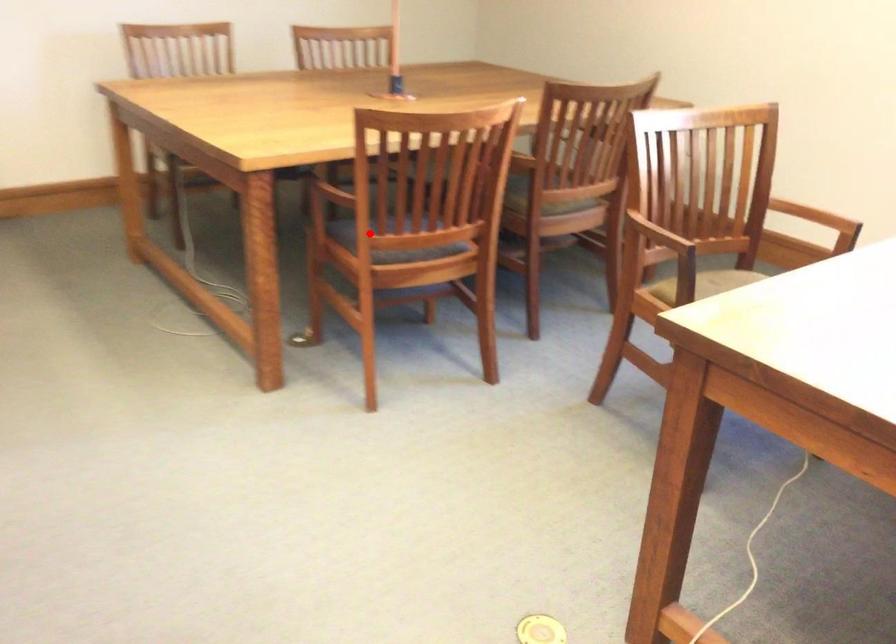
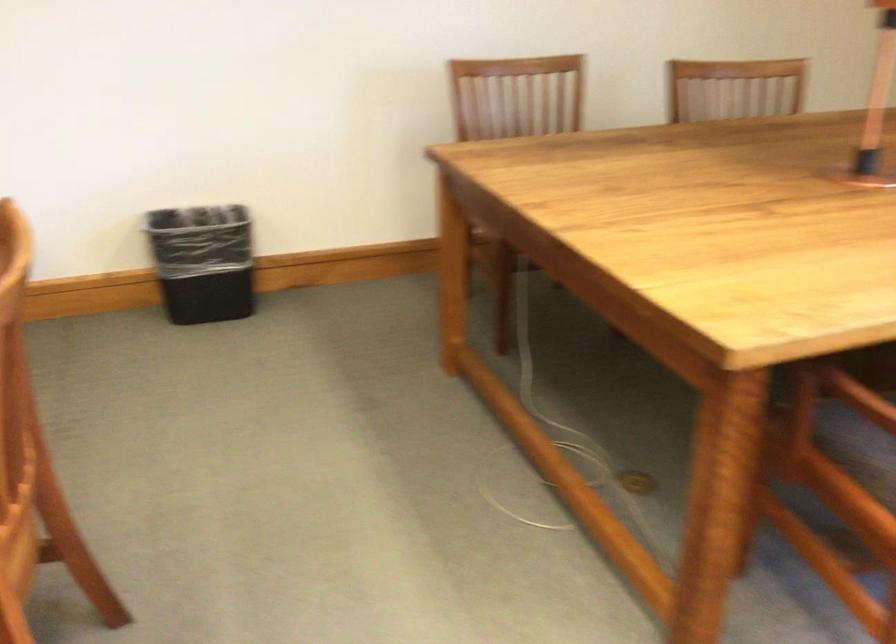
Question: I am providing you with two images of the same scene from different viewpoints. Image1 has a red point marked. In image2, the corresponding 3D location appears at what relative position? Reply with the corresponding letter.

Choices:
 (A) Closer
 (B) Farther

Answer: (A)